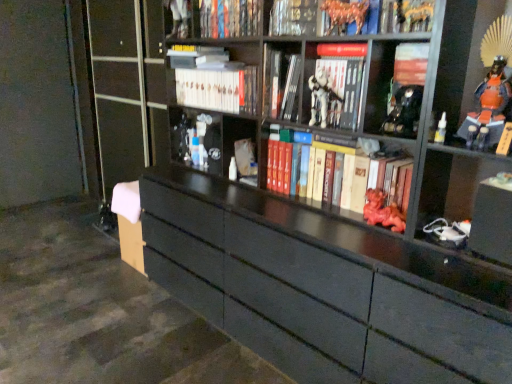
Question: Looking at their shapes, would you say hardcover book at upper center, marked as the 8th book in a bottom-to-top arrangement, is wider or thinner than hardcover book at center, marked as the fourth book in a bottom-to-top arrangement?

Choices:
 (A) wide
 (B) thin

Answer: (B)

Question: In the image, is hardcover book at upper center, the first book in the top-to-bottom sequence, on the left side or the right side of hardcover book at center, marked as the fourth book in a bottom-to-top arrangement?

Choices:
 (A) right
 (B) left

Answer: (B)

Question: Estimate the real-world distances between objects in this image. Which object is closer to the matte red statue at center, acting as the third toy starting from the back?

Choices:
 (A) white matte book at center, arranged as the sixth book when viewed from the top
 (B) hardcover book at upper center, the second book viewed from the top
 (C) orange glossy samurai armor at upper right
 (D) white plastic figure at center
 (E) metallic black helmet at upper right, arranged as the 6th toy when viewed from the back

Answer: (E)

Question: Estimate the real-world distances between objects in this image. Which object is closer to the white matte book at center, arranged as the sixth book when viewed from the top?

Choices:
 (A) hardcover book at center, marked as the fourth book in a bottom-to-top arrangement
 (B) translucent plastic bottle at upper right, which is the fifth toy from back to front
 (C) white glossy book at upper center, positioned as the sixth book in bottom-to-top order
 (D) hardcover book at upper center, the second book viewed from the top
 (E) white plastic spray bottle at center, acting as the second toy starting from the left

Answer: (A)